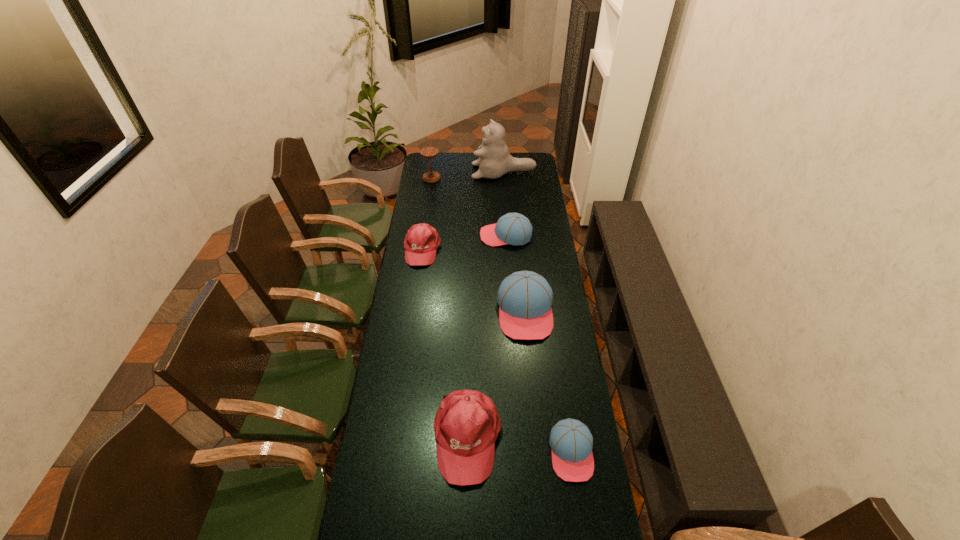
Locate an element on the screen. Image resolution: width=960 pixels, height=540 pixels. object that can be found as the fifth closest to the shortest object is located at coordinates (494, 161).

Identify the location of baseball cap that is the fourth closest to the farthest blue baseball cap. (571, 442).

Locate which baseball cap is the third closest to the bigger red baseball cap. Please provide its 2D coordinates. Your answer should be formatted as a tuple, i.e. [(x, y)], where the tuple contains the x and y coordinates of a point satisfying the conditions above.

[(422, 240)]

Identify which blue baseball cap is the second closest to the second smallest blue baseball cap. Please provide its 2D coordinates. Your answer should be formatted as a tuple, i.e. [(x, y)], where the tuple contains the x and y coordinates of a point satisfying the conditions above.

[(571, 442)]

The height and width of the screenshot is (540, 960). Identify the location of the second closest blue baseball cap to the third farthest baseball cap. (571, 442).

This screenshot has height=540, width=960. In order to click on red baseball cap object that ranks as the closest to the biggest blue baseball cap in this screenshot , I will do `click(467, 423)`.

The width and height of the screenshot is (960, 540). Find the location of `vacant region that satisfies the following two spatial constraints: 1. on the front-facing side of the second smallest blue baseball cap; 2. at the front of the leftmost baseball cap with the brim`. vacant region that satisfies the following two spatial constraints: 1. on the front-facing side of the second smallest blue baseball cap; 2. at the front of the leftmost baseball cap with the brim is located at coordinates (507, 249).

The image size is (960, 540). I want to click on vacant space that satisfies the following two spatial constraints: 1. on the face of the green cat; 2. at the front of the smaller red baseball cap with the brim, so click(x=509, y=249).